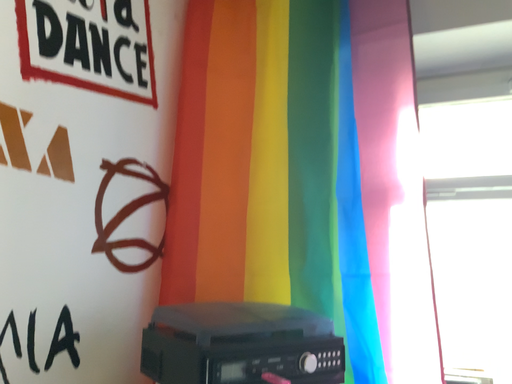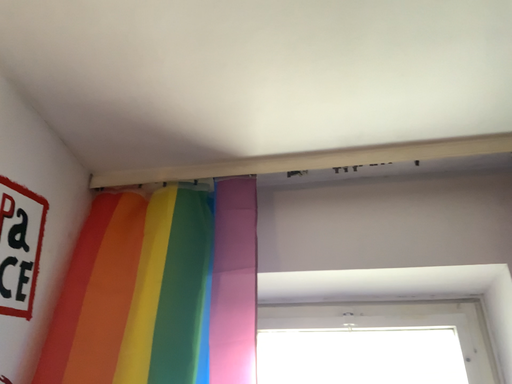
Question: Which way did the camera rotate in the video?

Choices:
 (A) rotated upward
 (B) rotated downward

Answer: (A)